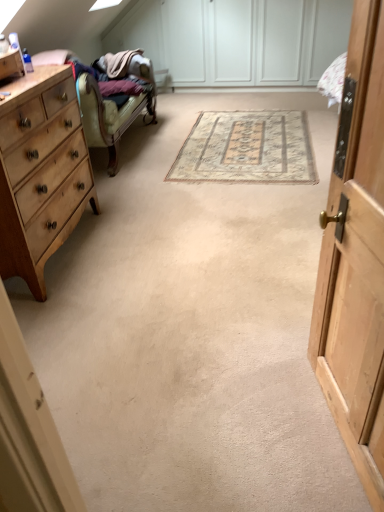
Question: Is wooden cabinet at right bigger than beige woven rug at center?

Choices:
 (A) no
 (B) yes

Answer: (B)

Question: Is wooden cabinet at right closer to the viewer compared to beige woven rug at center?

Choices:
 (A) yes
 (B) no

Answer: (A)

Question: From the image's perspective, does wooden cabinet at right appear higher than beige woven rug at center?

Choices:
 (A) no
 (B) yes

Answer: (A)

Question: Is wooden cabinet at right far from beige woven rug at center?

Choices:
 (A) no
 (B) yes

Answer: (B)

Question: From a real-world perspective, is wooden cabinet at right physically below beige woven rug at center?

Choices:
 (A) no
 (B) yes

Answer: (A)

Question: Considering the positions of point (213, 179) and point (370, 159), is point (213, 179) closer or farther from the camera than point (370, 159)?

Choices:
 (A) farther
 (B) closer

Answer: (A)

Question: In the image, is beige woven rug at center on the left side or the right side of wooden cabinet at right?

Choices:
 (A) right
 (B) left

Answer: (A)

Question: Relative to wooden cabinet at right, is beige woven rug at center in front or behind?

Choices:
 (A) behind
 (B) front

Answer: (A)

Question: Looking at the image, does beige woven rug at center seem bigger or smaller compared to wooden cabinet at right?

Choices:
 (A) big
 (B) small

Answer: (B)

Question: Considering the positions of light wood/finish chest of drawers at left and wooden cabinet at right in the image, is light wood/finish chest of drawers at left taller or shorter than wooden cabinet at right?

Choices:
 (A) short
 (B) tall

Answer: (A)

Question: Is light wood/finish chest of drawers at left bigger or smaller than wooden cabinet at right?

Choices:
 (A) small
 (B) big

Answer: (B)

Question: From the image's perspective, is light wood/finish chest of drawers at left above or below wooden cabinet at right?

Choices:
 (A) above
 (B) below

Answer: (A)

Question: In terms of width, does light wood/finish chest of drawers at left look wider or thinner when compared to wooden cabinet at right?

Choices:
 (A) wide
 (B) thin

Answer: (A)

Question: From the image's perspective, relative to beige woven rug at center, is wooden cabinet at right above or below?

Choices:
 (A) below
 (B) above

Answer: (A)

Question: Is wooden cabinet at right wider or thinner than beige woven rug at center?

Choices:
 (A) wide
 (B) thin

Answer: (B)